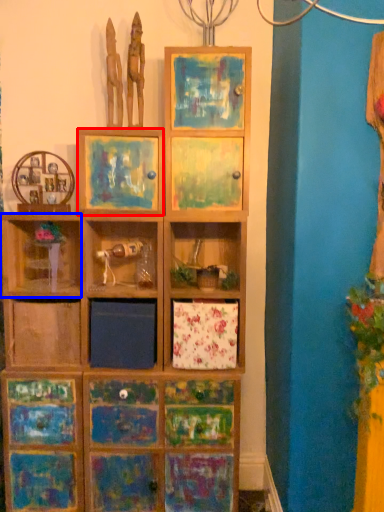
Question: Which object is further to the camera taking this photo, picture frame (highlighted by a red box) or shelf (highlighted by a blue box)?

Choices:
 (A) picture frame
 (B) shelf

Answer: (B)